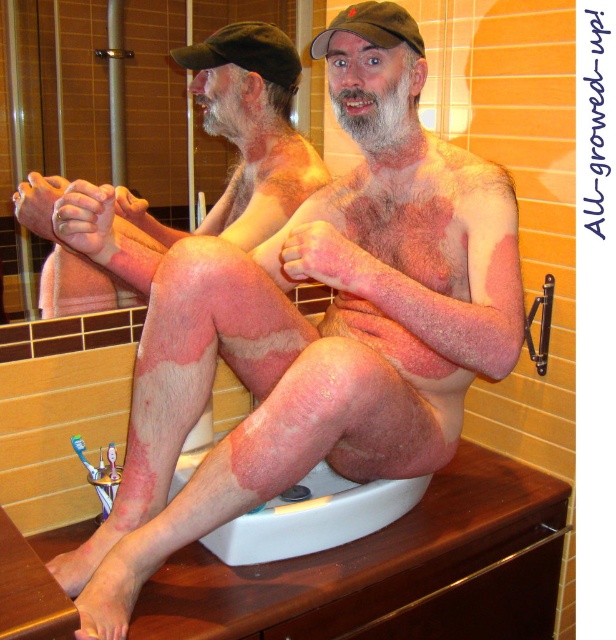
Based on the scene description, can you determine if the smooth skin man at center is sitting on the white plastic sink at lower center?

The smooth skin man at center is positioned over white plastic sink at lower center, so yes, he is sitting on it.

You are standing in front of the bathroom sink and need to place two stickers on the wall. The first sticker must be placed at point (x=229, y=74) and the second at point (x=296, y=550). Which sticker will be closer to your face when you look at them?

The sticker at point (x=229, y=74) will be closer to your face because it is further to the camera than point (x=296, y=550), meaning it is physically closer to your position when standing in front of the sink.

You are standing in the bathroom and want to reach the point at coordinates [248,99]. If your arm can extend 3 feet, can you reach that point?

The point at coordinates [248,99] is 4.56 feet away from you, which is farther than your arm can reach. You cannot reach it with your current arm extension of 3 feet.